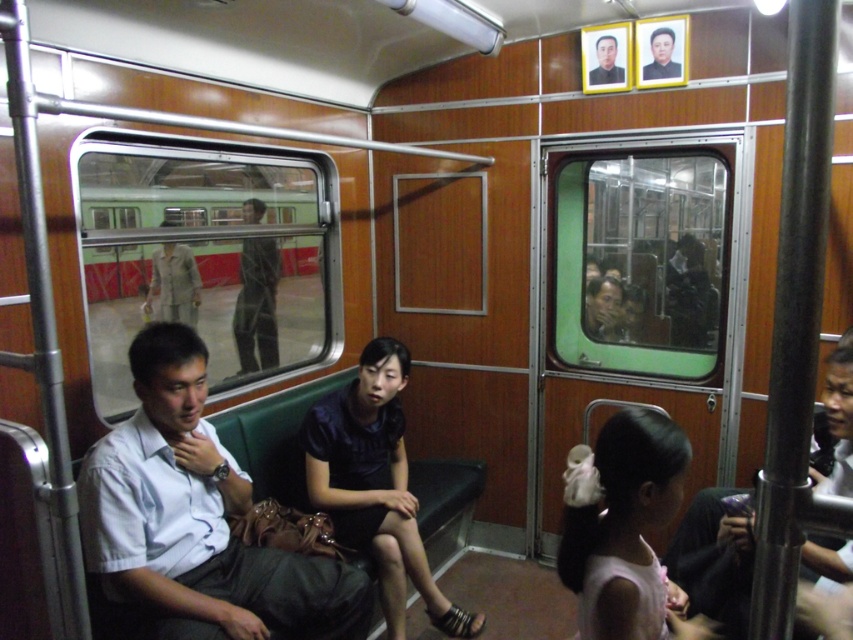
Question: Is dark blue dress at lower right wider than black glossy portrait at upper right?

Choices:
 (A) no
 (B) yes

Answer: (B)

Question: Where is matte white shirt at center located in relation to green matte train at center in the image?

Choices:
 (A) right
 (B) left

Answer: (A)

Question: Is black glossy portrait at upper right in front of smooth black portrait at upper center?

Choices:
 (A) no
 (B) yes

Answer: (B)

Question: Which object appears closest to the camera in this image?

Choices:
 (A) dark blue dress at lower right
 (B) dark blue satin dress at center
 (C) black glossy portrait at upper right

Answer: (A)

Question: Which of the following is the farthest from the observer?

Choices:
 (A) matte white shirt at center
 (B) light brown fabric jacket at center
 (C) smooth black portrait at upper center

Answer: (B)

Question: Among these points, which one is nearest to the camera?

Choices:
 (A) (601, 80)
 (B) (155, 618)
 (C) (665, 29)
 (D) (167, 250)

Answer: (B)